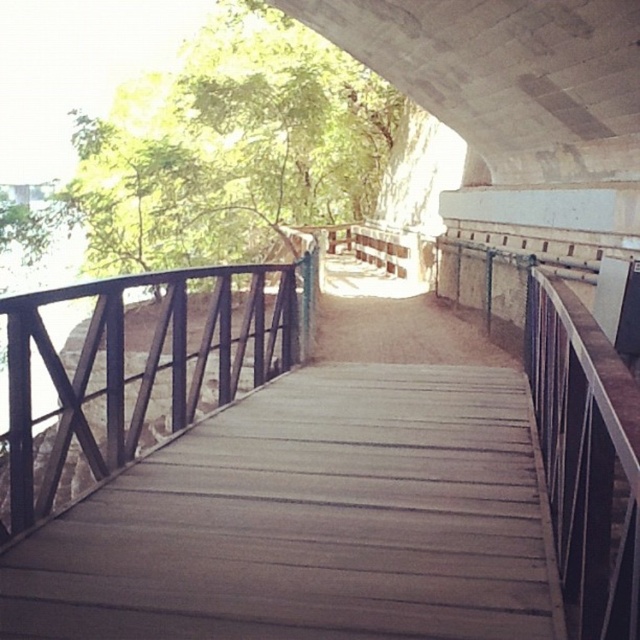
Question: Is brown wooden bridge at center smaller than brown wooden rail at center?

Choices:
 (A) no
 (B) yes

Answer: (B)

Question: Which point is closer to the camera?

Choices:
 (A) (65, 285)
 (B) (304, 504)

Answer: (A)

Question: Which object appears farthest from the camera in this image?

Choices:
 (A) brown wooden rail at center
 (B) brown wooden bridge at center

Answer: (A)

Question: Can you confirm if brown wooden bridge at center is bigger than brown wooden rail at center?

Choices:
 (A) no
 (B) yes

Answer: (A)

Question: Where is brown wooden bridge at center located in relation to brown wooden rail at center in the image?

Choices:
 (A) below
 (B) above

Answer: (B)

Question: Which point is farther to the camera?

Choices:
 (A) (289, 268)
 (B) (564, 376)

Answer: (A)